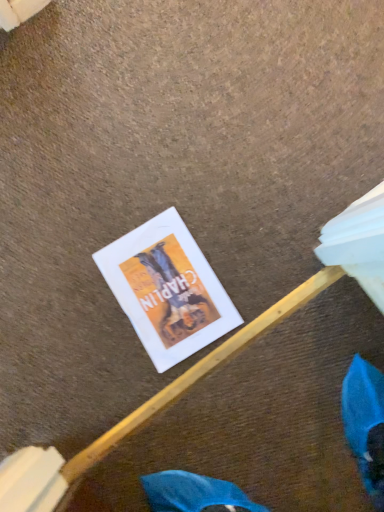
Where is `free spot to the left of white paper book at center`? free spot to the left of white paper book at center is located at coordinates (82, 345).